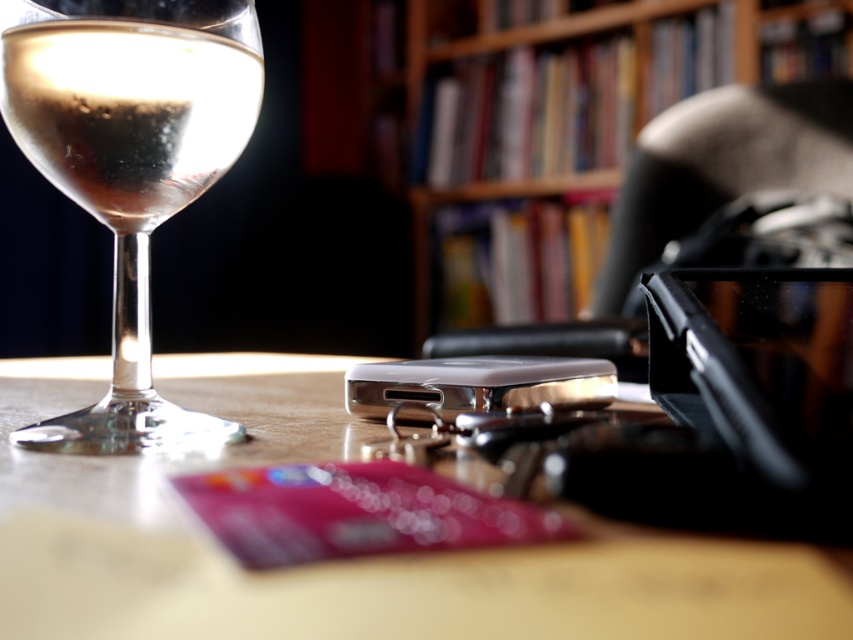
Is point (207, 17) in front of point (224, 120)?

Yes, it is in front of point (224, 120).

Is clear glass wine glass at left behind clear glass wine at left?

No, clear glass wine glass at left is closer to the viewer.

Who is more distant from viewer, [144,392] or [113,152]?

The point [144,392] is more distant.

The width and height of the screenshot is (853, 640). What are the coordinates of `clear glass wine glass at left` in the screenshot? It's located at (131, 164).

Is smooth wooden table at center wider than clear glass wine glass at left?

Yes.

Can you confirm if smooth wooden table at center is smaller than clear glass wine glass at left?

Actually, smooth wooden table at center might be larger than clear glass wine glass at left.

This screenshot has height=640, width=853. Find the location of `smooth wooden table at center`. smooth wooden table at center is located at coordinates (338, 563).

What are the coordinates of `smooth wooden table at center` in the screenshot? It's located at (338, 563).

Can you confirm if smooth wooden table at center is shorter than wooden bookcase at upper center?

Yes, smooth wooden table at center is shorter than wooden bookcase at upper center.

Measure the distance between smooth wooden table at center and camera.

They are 4.80 inches apart.

Measure the distance between smooth wooden table at center and camera.

A distance of 4.80 inches exists between smooth wooden table at center and camera.

Locate an element on the screen. This screenshot has width=853, height=640. smooth wooden table at center is located at coordinates (338, 563).